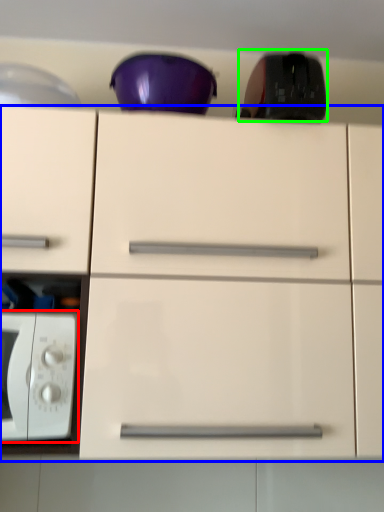
Question: Considering the real-world distances, which object is closest to microwave oven (highlighted by a red box)? cabinetry (highlighted by a blue box) or appliance (highlighted by a green box).

Choices:
 (A) cabinetry
 (B) appliance

Answer: (A)